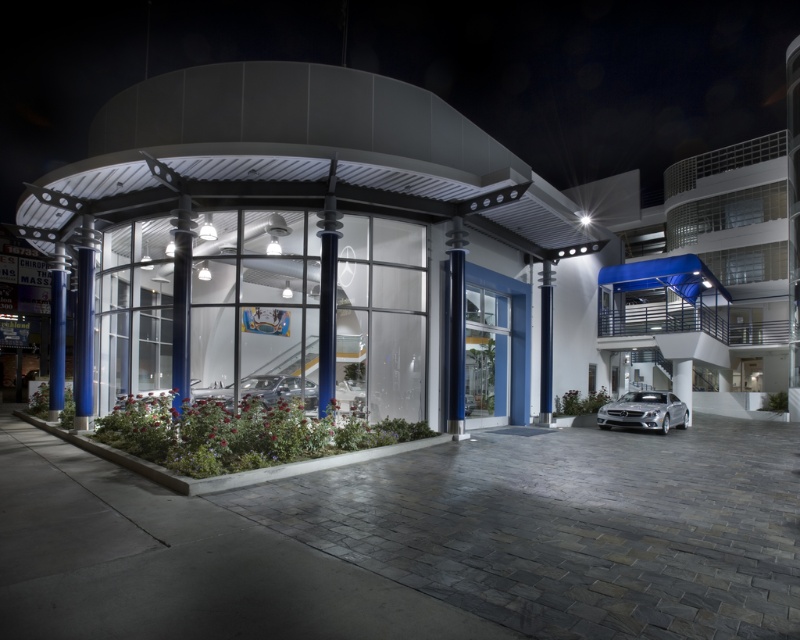
You are a delivery person trying to park a new car that is 5 meters long. The parking space available is next to the glassy white car at center and the silver metallic car at lower right. Based on their sizes, can you fit your car between them?

The glassy white car at center is bigger than the silver metallic car at lower right. Since the parking space is between them, the total available space depends on the distance between the two cars. However, without knowing the exact distance between them, it is impossible to determine if the 5 meter long car will fit. The size comparison alone does not provide enough information about the spacing between the cars.

You are standing outside the modern automotive showroom and want to take a photo of the glassy white car at center. Considering the distance, can you capture the entire car in your smartphone camera without moving closer? Assume your smartphone has a standard wide angle lens with a maximum field of view of 75 degrees.

The glassy white car at center is 36.04 feet away from the viewer. To determine if it can be captured entirely, we need to know the car length and the angle it subtends at that distance. Without specific car dimensions or angular measurements, a definitive answer isn